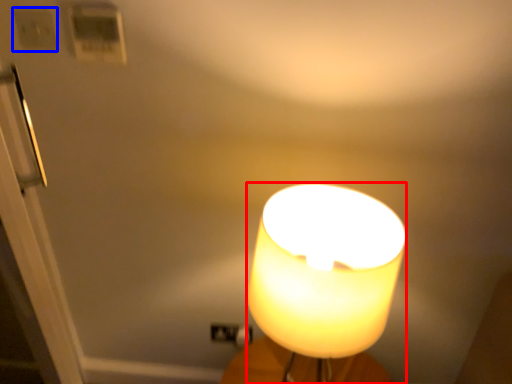
Question: Which object is further to the camera taking this photo, lamp (highlighted by a red box) or light switch (highlighted by a blue box)?

Choices:
 (A) lamp
 (B) light switch

Answer: (B)